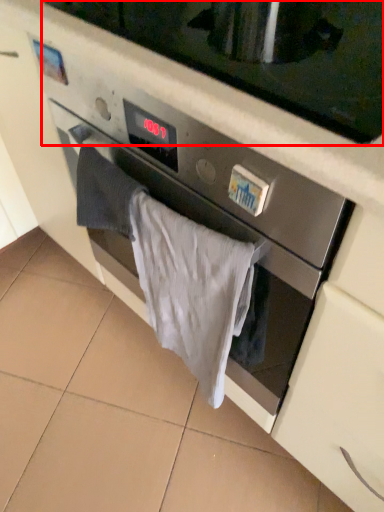
Question: From the image's perspective, considering the relative positions of microwave oven (annotated by the red box) and bath towel in the image provided, where is microwave oven (annotated by the red box) located with respect to the staircase?

Choices:
 (A) below
 (B) above

Answer: (B)